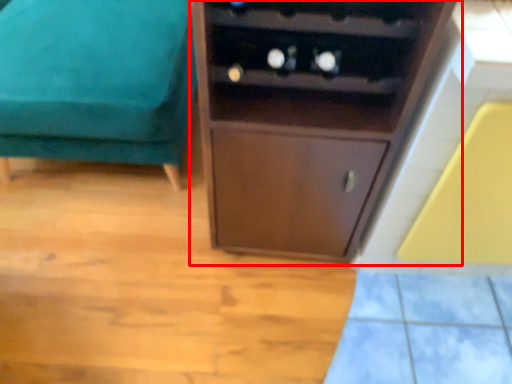
Question: From the image's perspective, considering the relative positions of cupboard (annotated by the red box) and furniture in the image provided, where is cupboard (annotated by the red box) located with respect to the staircase?

Choices:
 (A) below
 (B) above

Answer: (A)